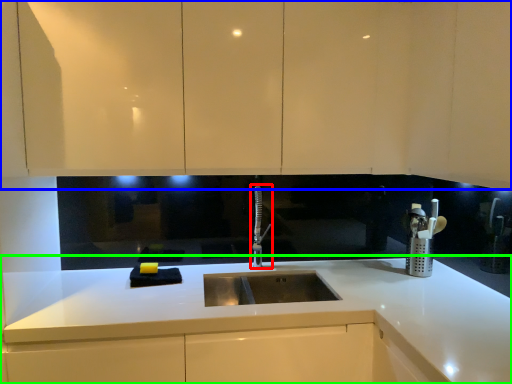
Question: Which object is the closest to the tap (highlighted by a red box)? Choose among these: cabinetry (highlighted by a blue box) or countertop (highlighted by a green box).

Choices:
 (A) cabinetry
 (B) countertop

Answer: (B)